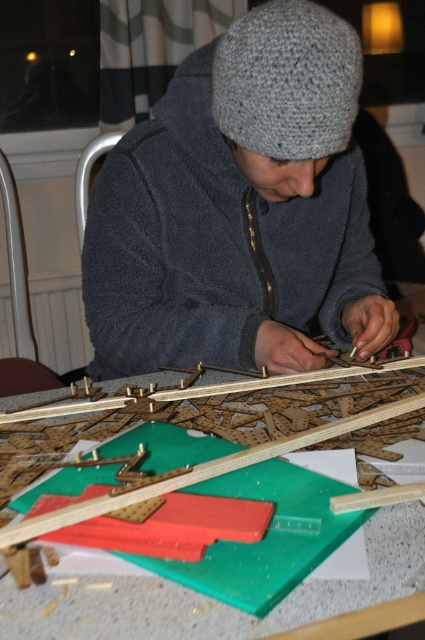
You are a craftsperson looking at the gray knitted hat at upper center and the gray knitted hat at center. Which one has a greater width?

The gray knitted hat at upper center has a greater width than the gray knitted hat at center.

You are trying to determine if the gray knitted hat at center can be placed inside the green plastic table at center. Based on their sizes, is this possible?

The gray knitted hat at center is thinner than the green plastic table at center, so it can fit inside.